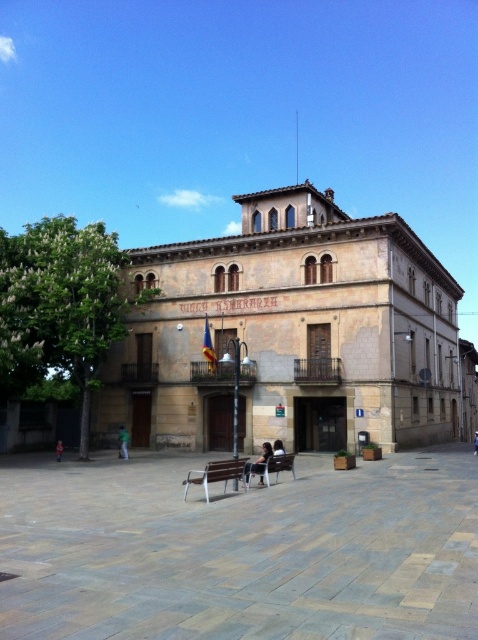
Question: Considering the real-world distances, which object is farthest from the green fabric person at center?

Choices:
 (A) metallic silver bench at center
 (B) wooden bench at center

Answer: (B)

Question: Considering the real-world distances, which object is closest to the wooden bench at center?

Choices:
 (A) green fabric person at center
 (B) dark blue jeans at lower left

Answer: (A)

Question: Is green fabric person at center smaller than dark blue jeans at lower left?

Choices:
 (A) no
 (B) yes

Answer: (B)

Question: Does green fabric person at center have a larger size compared to dark blue jeans at lower left?

Choices:
 (A) yes
 (B) no

Answer: (B)

Question: Which point appears farthest from the camera in this image?

Choices:
 (A) (61, 458)
 (B) (249, 467)
 (C) (230, 472)

Answer: (A)

Question: Is wooden bench at center positioned behind dark blue jeans at lower left?

Choices:
 (A) yes
 (B) no

Answer: (B)